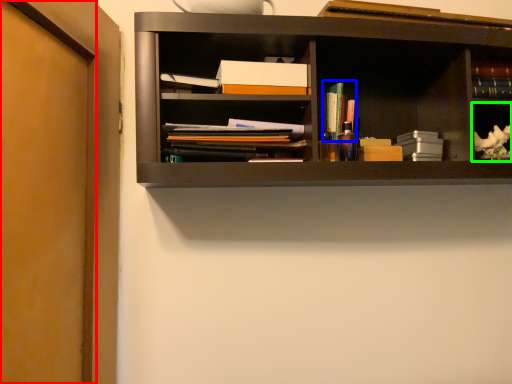
Question: Which object is the closest to the door (highlighted by a red box)? Choose among these: book (highlighted by a blue box) or cabinet (highlighted by a green box).

Choices:
 (A) book
 (B) cabinet

Answer: (A)